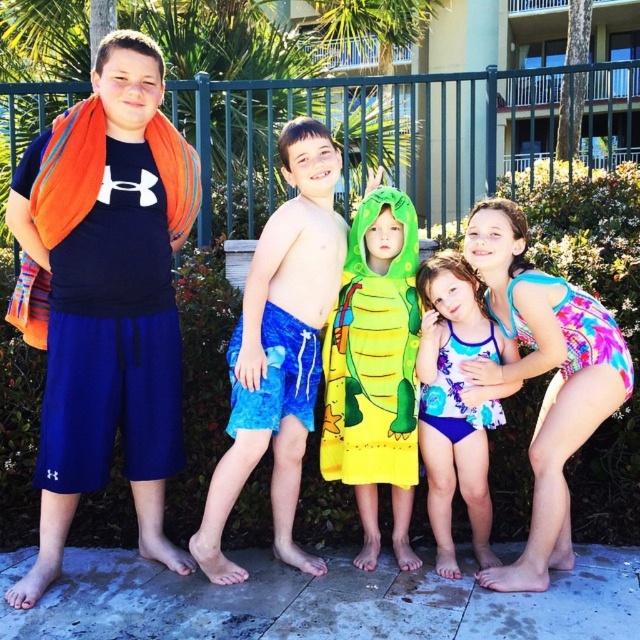
Who is lower down, multicolored swimsuit at right or blue printed swimsuit at center?

blue printed swimsuit at center is below.

Is point (620, 368) behind point (444, 552)?

No, it is in front of (444, 552).

Is point (563, 348) more distant than point (481, 442)?

That is False.

Locate an element on the screen. This screenshot has height=640, width=640. multicolored swimsuit at right is located at coordinates (544, 372).

Does point (182, 189) come behind point (592, 353)?

Yes, it is.

Is orange towel at left closer to the viewer compared to multicolored swimsuit at right?

Yes.

Identify the location of orange towel at left. (109, 300).

Find the location of a particular element. orange towel at left is located at coordinates (109, 300).

Is blue textured shorts at center behind yellow fabric towel at center?

No, blue textured shorts at center is closer to the viewer.

Is blue textured shorts at center below yellow fabric towel at center?

Correct, blue textured shorts at center is located below yellow fabric towel at center.

Is point (230, 426) farther from viewer compared to point (323, 436)?

No, (230, 426) is in front of (323, 436).

The height and width of the screenshot is (640, 640). Identify the location of blue textured shorts at center. (280, 349).